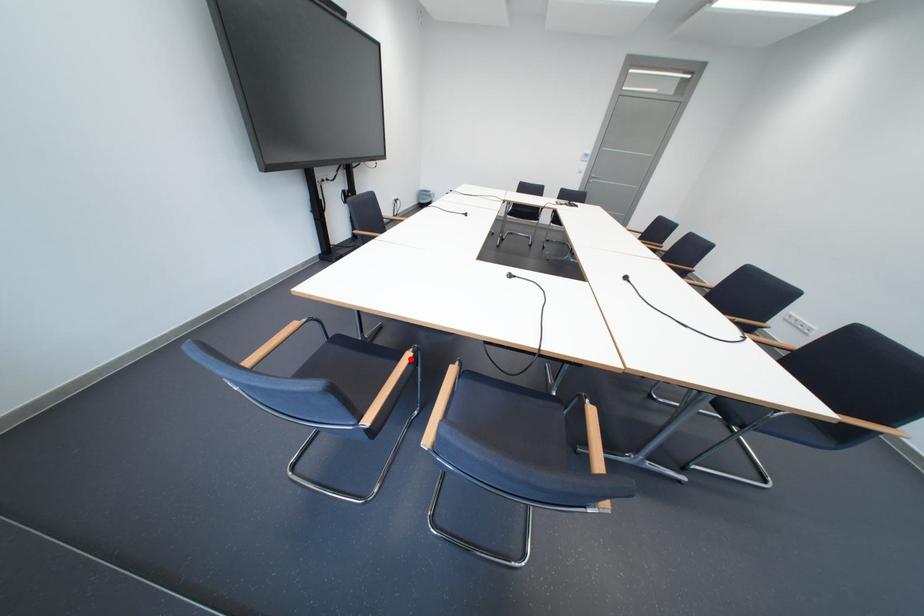
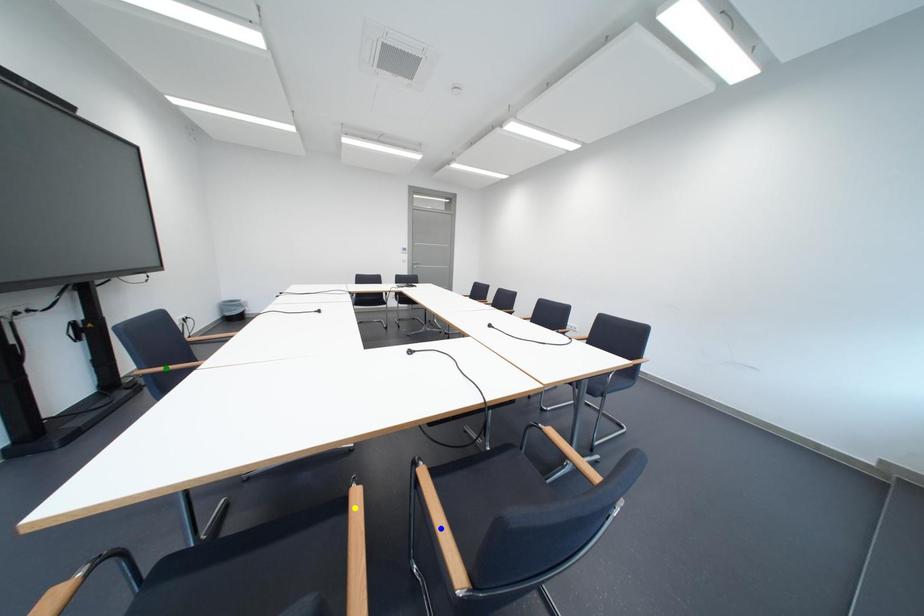
Question: I am providing you with two images of the same scene from different viewpoints. A red point is marked on the first image. You are given multiple points on the second image. Which spot in image 2 lines up with the point in image 1?

Choices:
 (A) green point
 (B) blue point
 (C) yellow point

Answer: (C)